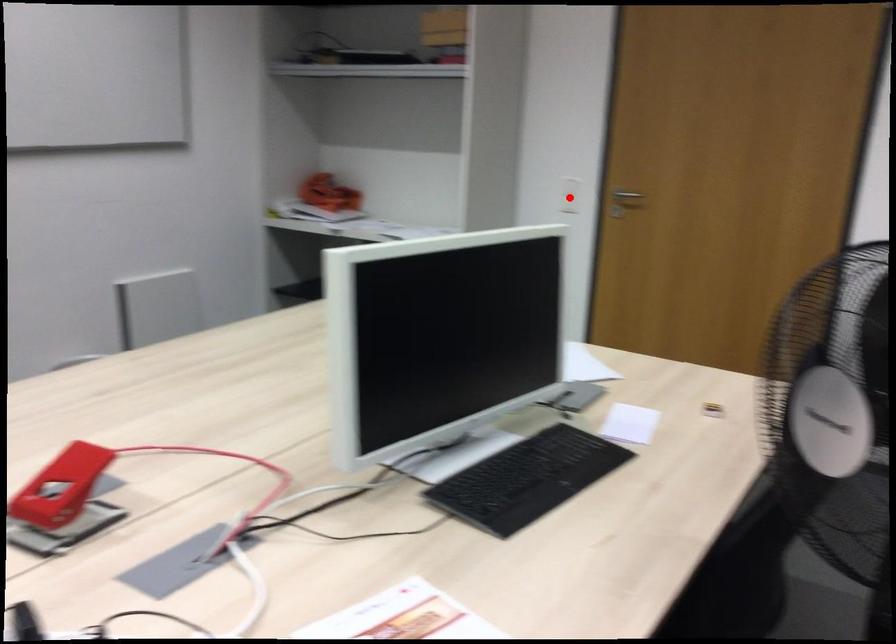
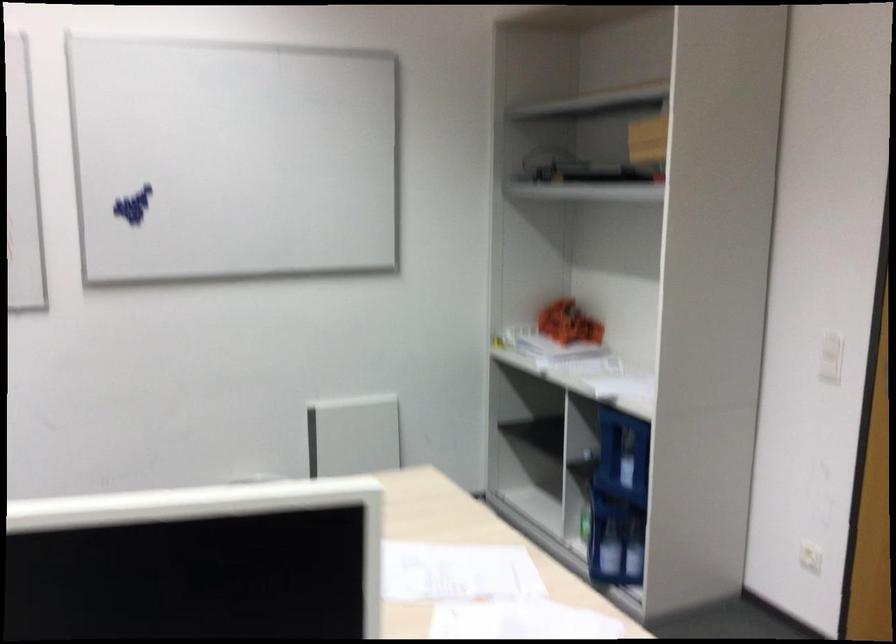
Locate, in the second image, the point that corresponds to the highlighted location in the first image.

(830, 357)